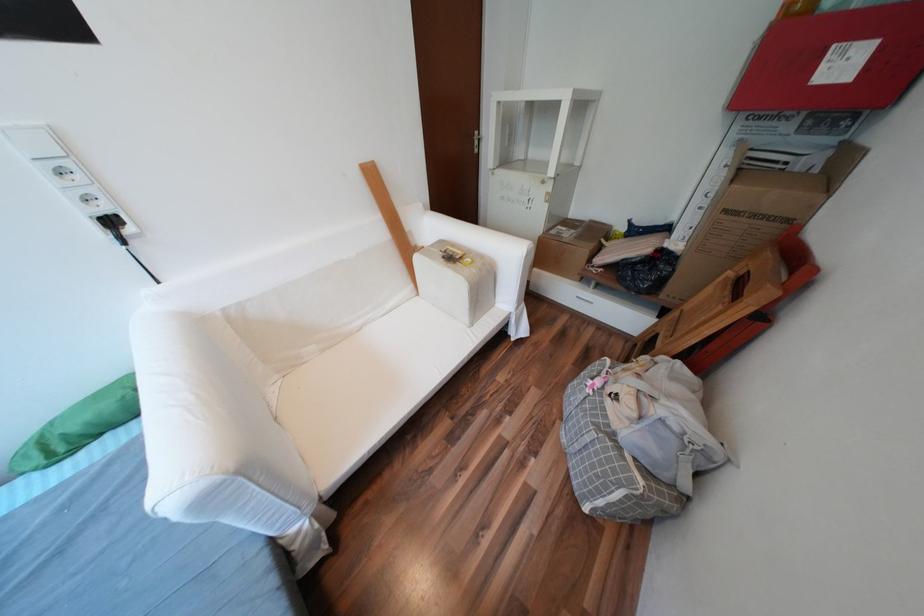
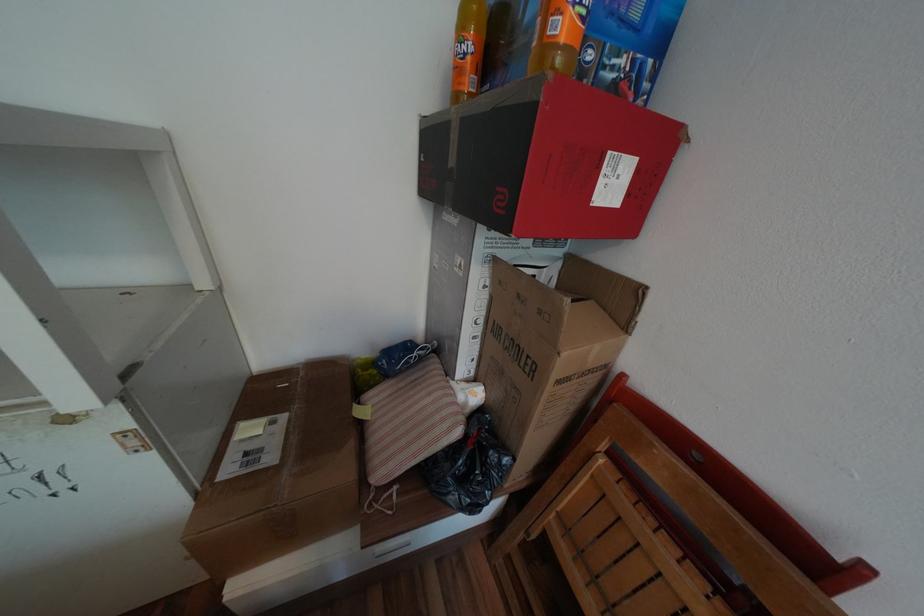
Where in the second image is the point corresponding to the point at 832,67 from the first image?

(611, 182)